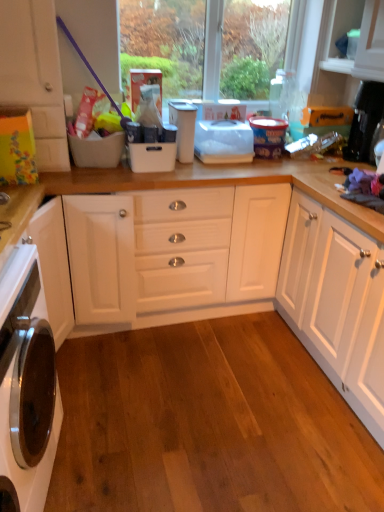
Question: Is point (168, 36) closer or farther from the camera than point (34, 74)?

Choices:
 (A) farther
 (B) closer

Answer: (A)

Question: Is transparent plastic window screen at upper center taller or shorter than white matte cabinet at left?

Choices:
 (A) tall
 (B) short

Answer: (B)

Question: Based on their relative distances, which object is nearer to the white glossy oven at lower left?

Choices:
 (A) white matte cabinet at left
 (B) white plastic container at center
 (C) transparent plastic window screen at upper center

Answer: (A)

Question: Which object is positioned closest to the white matte cabinet at left?

Choices:
 (A) white plastic container at center
 (B) transparent plastic window screen at upper center
 (C) white glossy oven at lower left

Answer: (A)